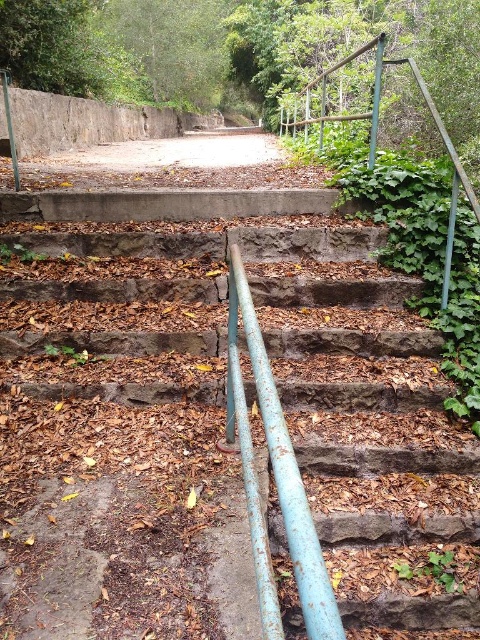
Question: Which object is closer to the camera taking this photo?

Choices:
 (A) rusty metal railing at upper right
 (B) rusty metal railing at center

Answer: (B)

Question: Among these points, which one is nearest to the camera?

Choices:
 (A) (x=447, y=141)
 (B) (x=298, y=582)

Answer: (B)

Question: Which is farther from the rusty metal rail at center?

Choices:
 (A) rusty metal railing at center
 (B) rusty metal railing at upper right

Answer: (B)

Question: Is rusty metal railing at center thinner than rusty metal railing at upper right?

Choices:
 (A) no
 (B) yes

Answer: (A)

Question: Does rusty metal rail at center lie behind rusty metal railing at upper right?

Choices:
 (A) yes
 (B) no

Answer: (B)

Question: Can you confirm if rusty metal railing at center is positioned above rusty metal rail at center?

Choices:
 (A) yes
 (B) no

Answer: (A)